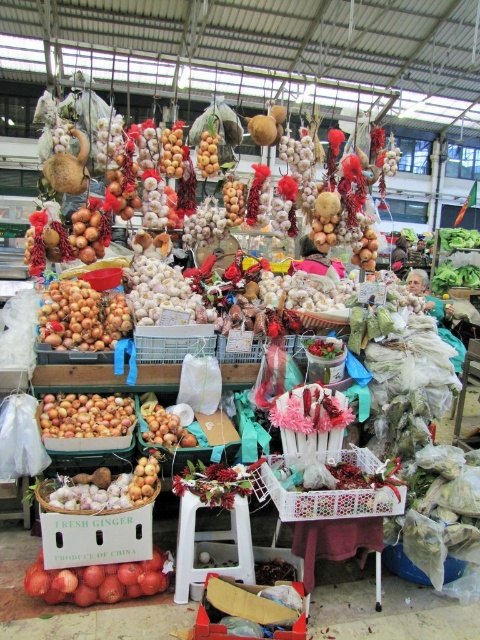
Consider the image. Does smooth brown onions at center have a greater width compared to red glossy tomatoes at lower left?

No, smooth brown onions at center is not wider than red glossy tomatoes at lower left.

Is smooth brown onions at center taller than red glossy tomatoes at lower left?

Correct, smooth brown onions at center is much taller as red glossy tomatoes at lower left.

This screenshot has height=640, width=480. What are the coordinates of `smooth brown onions at center` in the screenshot? It's located at (82, 316).

Does white plastic crate at center have a greater height compared to smooth golden garlic at center?

No, white plastic crate at center is not taller than smooth golden garlic at center.

Does white plastic crate at center appear on the right side of smooth golden garlic at center?

Indeed, white plastic crate at center is positioned on the right side of smooth golden garlic at center.

The width and height of the screenshot is (480, 640). What are the coordinates of `white plastic crate at center` in the screenshot? It's located at (330, 499).

Which is more to the right, white plastic crate at center or matte brown onions at center?

From the viewer's perspective, white plastic crate at center appears more on the right side.

Measure the distance between point (x=340, y=451) and camera.

Point (x=340, y=451) is 2.99 meters from camera.

Measure the distance between point (291, 518) and camera.

Point (291, 518) is 8.20 feet from camera.

Find the location of a particular element. white plastic crate at center is located at coordinates (330, 499).